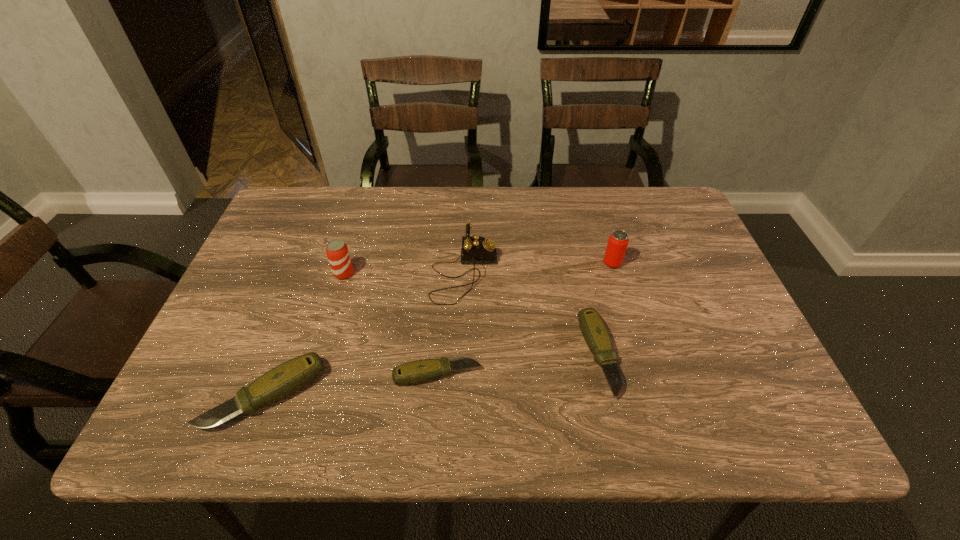
I want to click on vacant space at the near left corner of the desktop, so click(x=236, y=386).

Locate an element on the screen. The image size is (960, 540). free space at the far right corner of the desktop is located at coordinates click(684, 221).

Find the location of `free space at the near right corner of the desktop`. free space at the near right corner of the desktop is located at coordinates (756, 396).

Locate an element on the screen. This screenshot has width=960, height=540. vacant space that's between the leftmost pocketknife and the telephone is located at coordinates pos(365,334).

Locate an element on the screen. The width and height of the screenshot is (960, 540). unoccupied area between the telephone and the rightmost object is located at coordinates (539, 268).

I want to click on free space between the right beer can and the second tallest pocketknife, so click(606, 309).

Where is `vacant area that lies between the leftmost pocketknife and the telephone`? Image resolution: width=960 pixels, height=540 pixels. vacant area that lies between the leftmost pocketknife and the telephone is located at coordinates (365, 334).

Identify the location of empty space between the left beer can and the leftmost pocketknife. (304, 334).

The width and height of the screenshot is (960, 540). I want to click on empty space between the second object from right to left and the left beer can, so click(471, 315).

Locate an element on the screen. vacant space that's between the left beer can and the rightmost object is located at coordinates (478, 268).